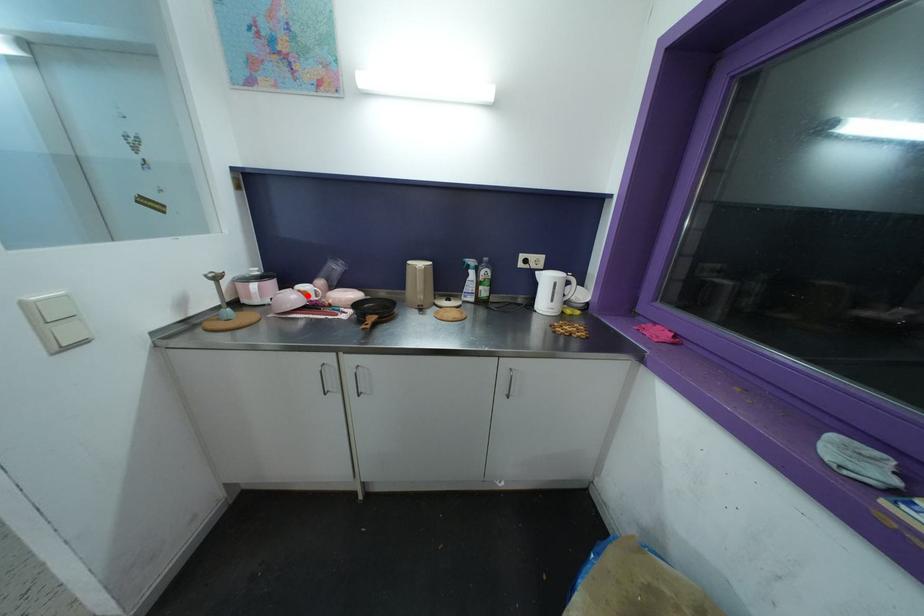
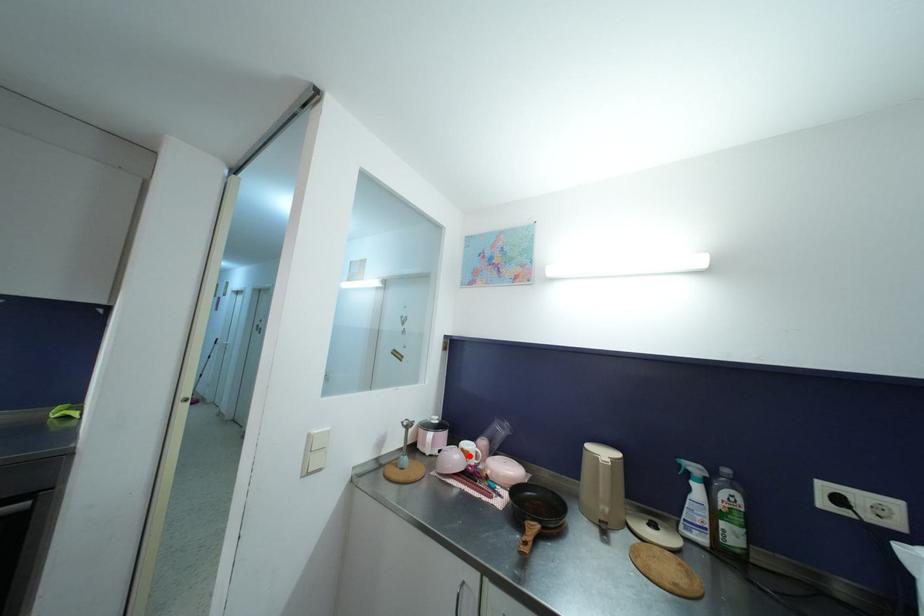
I am providing you with two images of the same scene from different viewpoints. A red point is marked on the first image and another point is marked on the second image. Are the points marked in image1 and image2 representing the same 3D position?

Yes